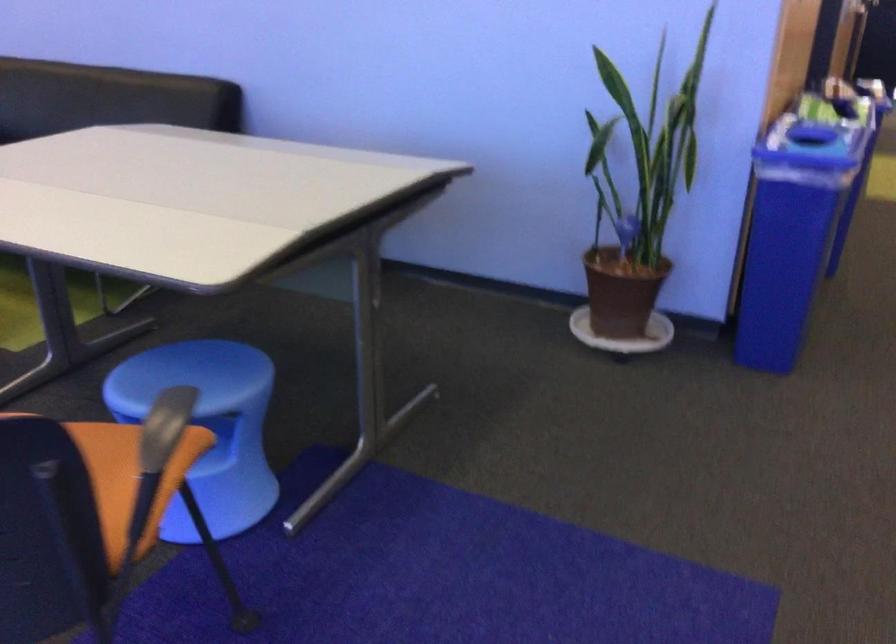
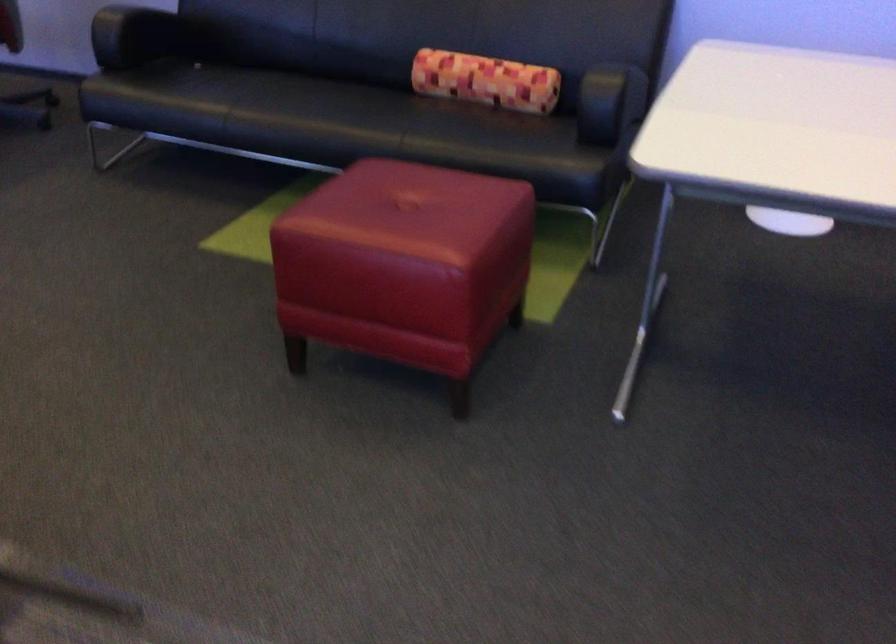
Question: Which direction would the cameraman need to move to produce the second image? Reply with the corresponding letter.

Choices:
 (A) Left
 (B) Right
 (C) Forward
 (D) Backward

Answer: (A)